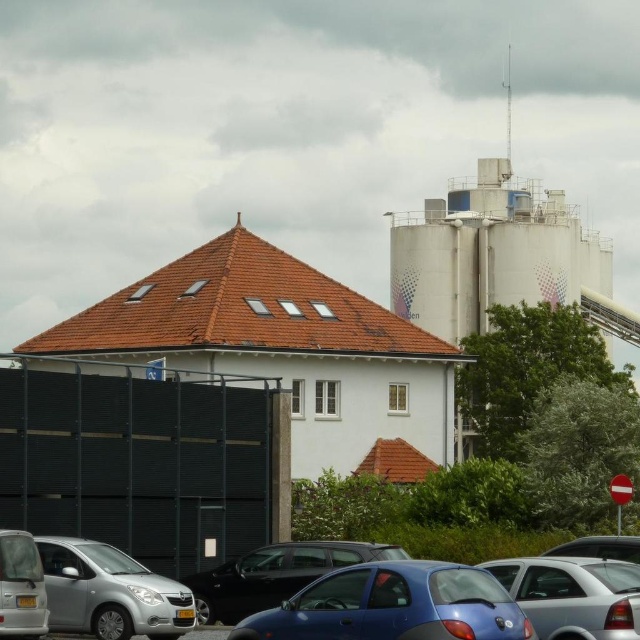
Question: Which of these objects is positioned closest to the metallic blue sedan at center?

Choices:
 (A) metallic silver car at lower right
 (B) metallic blue hatchback at center
 (C) silver metallic car at lower left

Answer: (B)

Question: Estimate the real-world distances between objects in this image. Which object is farther from the shiny black sedan at center?

Choices:
 (A) metallic silver car at lower right
 (B) silver metallic car at lower left
 (C) metallic blue sedan at center
 (D) silver metallic hatchback at lower left

Answer: (C)

Question: Can you confirm if shiny black sedan at center is positioned below metallic silver car at lower right?

Choices:
 (A) yes
 (B) no

Answer: (A)

Question: Among these points, which one is farthest from the camera?

Choices:
 (A) (64, 595)
 (B) (260, 632)
 (C) (584, 545)
 (D) (204, 573)

Answer: (D)

Question: Is the position of metallic blue sedan at center less distant than that of metallic silver car at lower right?

Choices:
 (A) no
 (B) yes

Answer: (B)

Question: Does metallic blue hatchback at center have a smaller size compared to silver metallic hatchback at lower left?

Choices:
 (A) yes
 (B) no

Answer: (B)